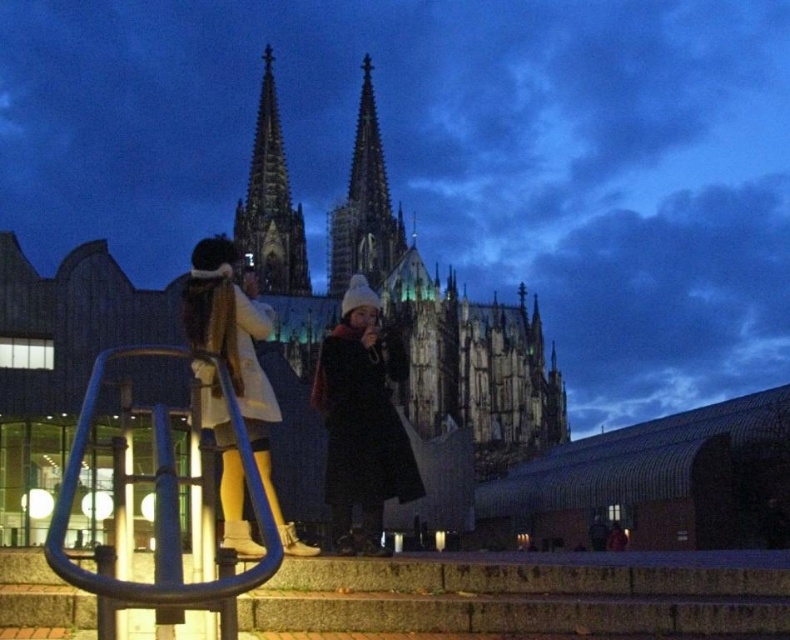
Does point (382, 465) come closer to viewer compared to point (309, 291)?

Yes.

Find the location of a particular element. black matte coat at center is located at coordinates (362, 420).

Find the location of a particular element. black matte coat at center is located at coordinates (362, 420).

Between white woolen hat at center and dark gray stone tower at center, which one is positioned lower?

white woolen hat at center

Does white woolen hat at center have a larger size compared to dark gray stone tower at center?

Yes, white woolen hat at center is bigger than dark gray stone tower at center.

At what (x,y) coordinates should I click in order to perform the action: click on white woolen hat at center. Please return your answer as a coordinate pair (x, y). The height and width of the screenshot is (640, 790). Looking at the image, I should click on (237, 356).

Identify the location of dark gray stone tower at center. (363, 205).

Who is more distant from viewer, (352,184) or (592,528)?

Positioned behind is point (352,184).

What are the coordinates of `dark gray stone tower at center` in the screenshot? It's located at (363, 205).

At what (x,y) coordinates should I click in order to perform the action: click on dark gray stone tower at center. Please return your answer as a coordinate pair (x, y). The height and width of the screenshot is (640, 790). Looking at the image, I should click on (363, 205).